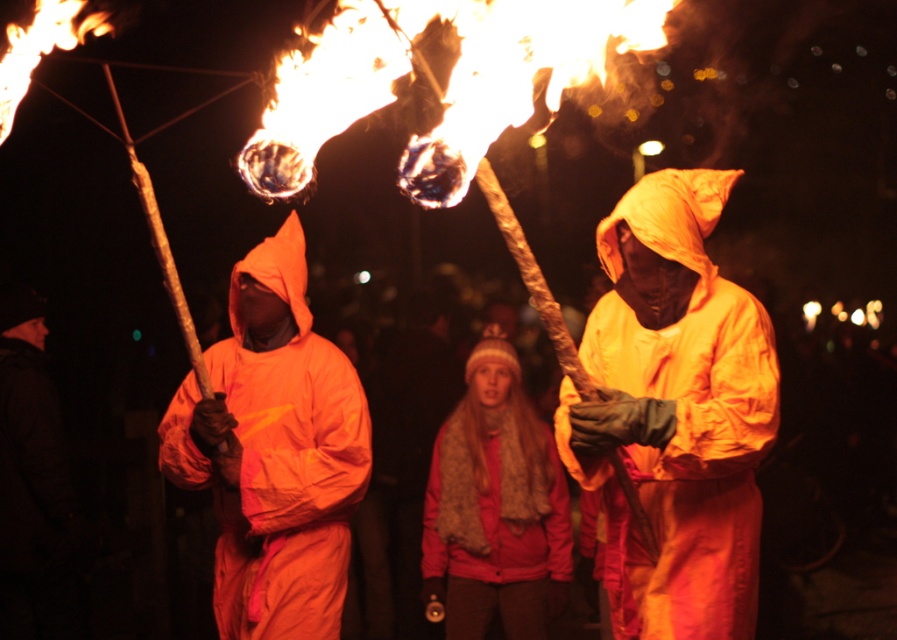
Question: Does matte yellow robe at center have a larger size compared to knitted woolen hat at center?

Choices:
 (A) no
 (B) yes

Answer: (B)

Question: Estimate the real-world distances between objects in this image. Which object is closer to the orange matte/soft robe at left?

Choices:
 (A) matte yellow robe at center
 (B) knitted woolen hat at center

Answer: (A)

Question: Which of the following is the closest to the observer?

Choices:
 (A) (241, 273)
 (B) (460, 512)
 (C) (695, 448)

Answer: (C)

Question: Which object appears closest to the camera in this image?

Choices:
 (A) matte yellow robe at center
 (B) orange matte/soft robe at left
 (C) knitted woolen hat at center

Answer: (A)

Question: Can you confirm if orange matte/soft robe at left is positioned to the left of knitted woolen hat at center?

Choices:
 (A) yes
 (B) no

Answer: (A)

Question: Is orange matte/soft robe at left to the left of knitted woolen hat at center from the viewer's perspective?

Choices:
 (A) yes
 (B) no

Answer: (A)